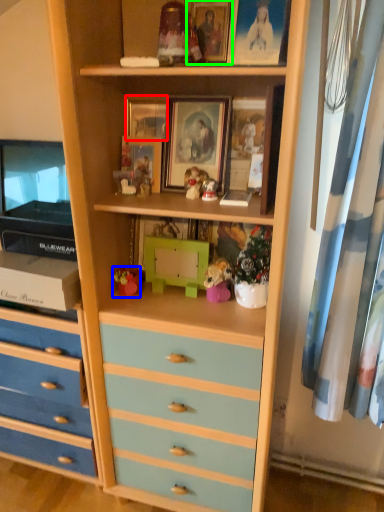
Question: Which is nearer to the picture frame (highlighted by a red box)? toy (highlighted by a blue box) or picture frame (highlighted by a green box).

Choices:
 (A) toy
 (B) picture frame

Answer: (B)